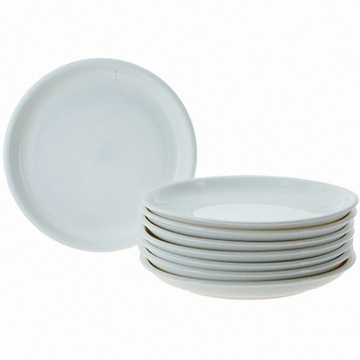
This screenshot has width=360, height=360. I want to click on white plates, so click(74, 168), click(247, 224), click(245, 234), click(245, 245), click(246, 254), click(246, 266), click(245, 276), click(243, 284).